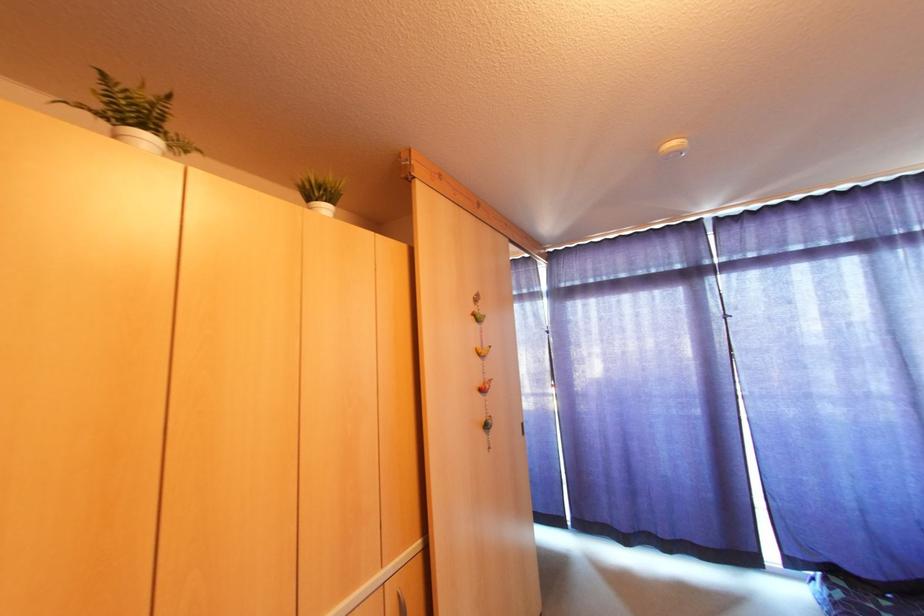
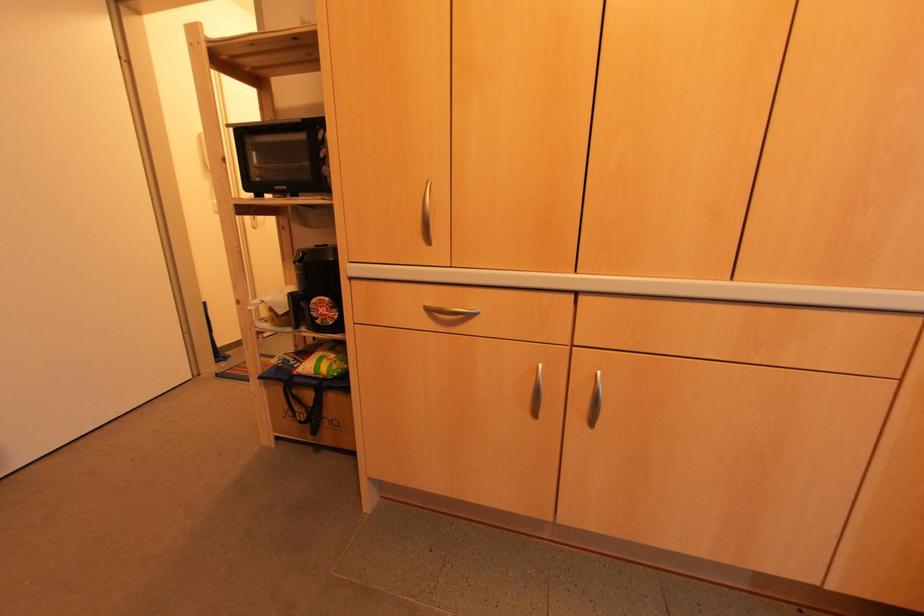
First-person continuous shooting, in which direction is the camera rotating?

The camera's rotation is toward left-down.